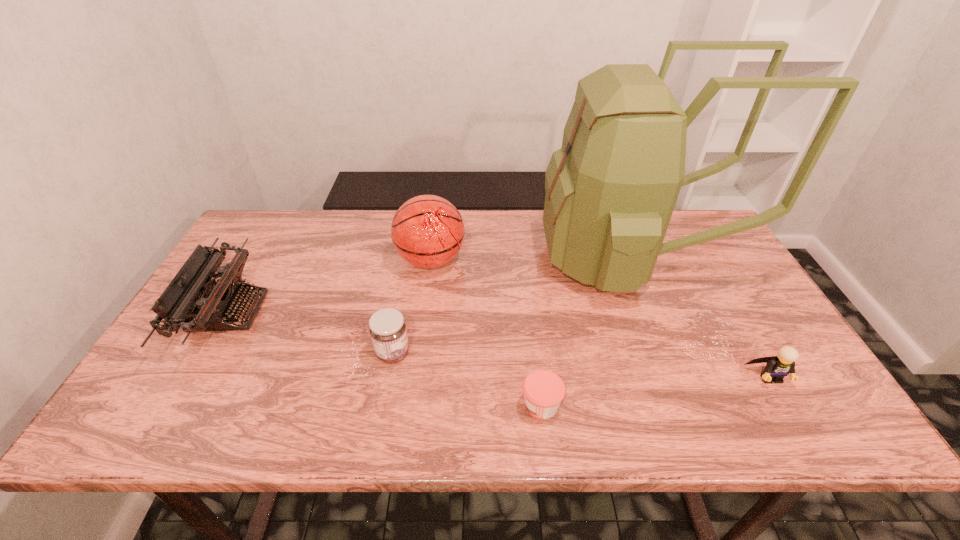
Find the location of a particular element. The height and width of the screenshot is (540, 960). object present at the near edge is located at coordinates (544, 390).

Find the location of a particular element. object positioned at the left edge is located at coordinates (192, 301).

Where is `backpack that is at the right edge`? backpack that is at the right edge is located at coordinates 611,189.

Identify the location of Lego that is at the right edge. (777, 367).

The height and width of the screenshot is (540, 960). I want to click on object that is at the far right corner, so click(x=611, y=189).

You are a GUI agent. You are given a task and a screenshot of the screen. Output one action in this format:
    pyautogui.click(x=<x>, y=<y>)
    Task: Click on the free space at the far edge of the desktop
    Image resolution: width=960 pixels, height=540 pixels.
    Given the screenshot: What is the action you would take?
    pyautogui.click(x=480, y=219)

The width and height of the screenshot is (960, 540). Find the location of `free location at the near edge of the desktop`. free location at the near edge of the desktop is located at coordinates (425, 410).

Locate an element on the screen. vacant space at the left edge is located at coordinates (259, 278).

Find the location of a particular element. This screenshot has width=960, height=540. vacant space at the right edge of the desktop is located at coordinates pyautogui.click(x=720, y=284).

The width and height of the screenshot is (960, 540). In the image, there is a desktop. What are the coordinates of `vacant space at the far right corner` in the screenshot? It's located at (727, 252).